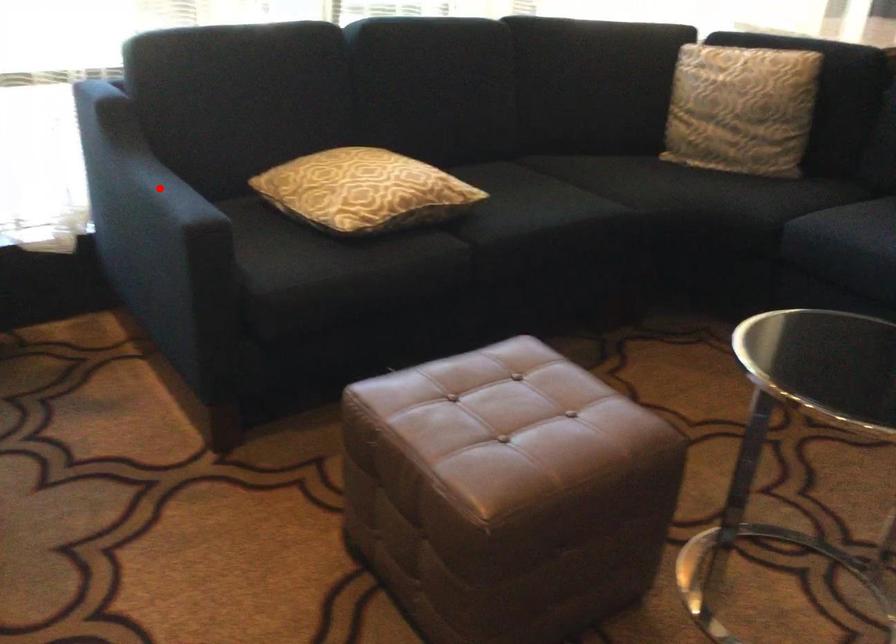
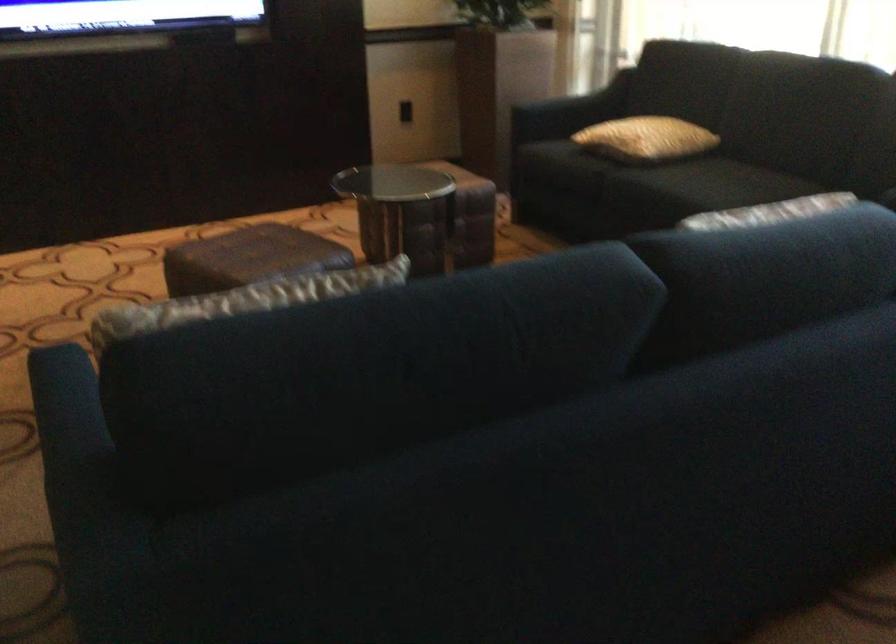
Question: A red point is marked in image1. In image2, is the corresponding 3D point closer to the camera or farther? Reply with the corresponding letter.

Choices:
 (A) The corresponding 3D point is closer.
 (B) The corresponding 3D point is farther.

Answer: (B)